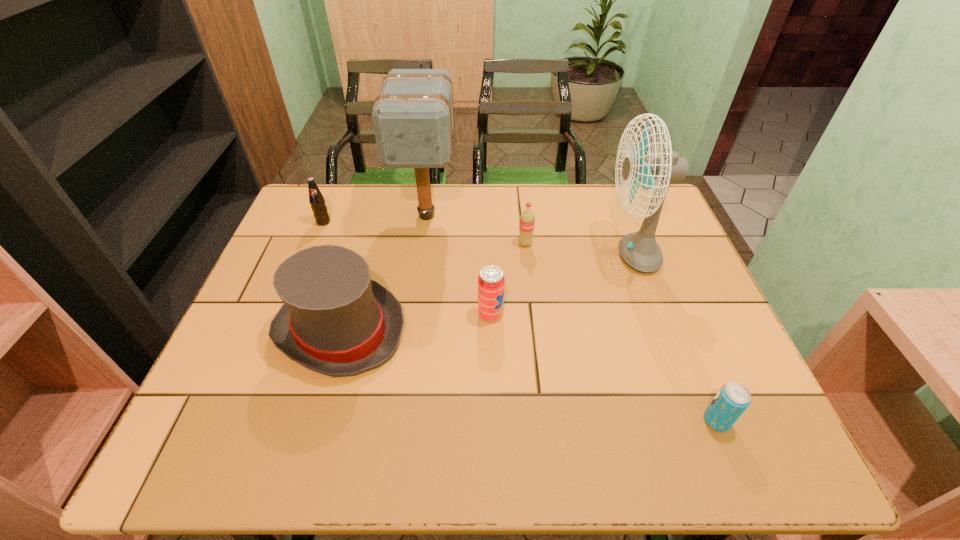
You are a GUI agent. You are given a task and a screenshot of the screen. Output one action in this format:
    pyautogui.click(x=<x>, y=<y>)
    Task: Click on the vacant space located 0.160m on the striking surface of the mallet
    This screenshot has height=540, width=960.
    Given the screenshot: What is the action you would take?
    pyautogui.click(x=417, y=283)

Image resolution: width=960 pixels, height=540 pixels. I want to click on vacant space positioned on the front-facing side of the fan, so click(x=470, y=254).

This screenshot has height=540, width=960. I want to click on free location located on the front-facing side of the fan, so click(x=464, y=254).

At what (x,y) coordinates should I click in order to perform the action: click on vacant region located 0.240m on the front-facing side of the fan. Please return your answer as a coordinate pair (x, y). Looking at the image, I should click on coord(517,254).

At what (x,y) coordinates should I click in order to perform the action: click on vacant region located on the right of the dress hat. Please return your answer as a coordinate pair (x, y). The width and height of the screenshot is (960, 540). Looking at the image, I should click on (537, 330).

Where is `vacant region located on the front label of the leftmost soda can`? vacant region located on the front label of the leftmost soda can is located at coordinates (294, 295).

Locate an element on the screen. Image resolution: width=960 pixels, height=540 pixels. free space located on the front of the third object from right to left is located at coordinates (535, 330).

You are a GUI agent. You are given a task and a screenshot of the screen. Output one action in this format:
    pyautogui.click(x=<x>, y=<y>)
    Task: Click on the free space located on the right of the fourth object from right to left
    The image size is (960, 540).
    Given the screenshot: What is the action you would take?
    pyautogui.click(x=586, y=314)

The width and height of the screenshot is (960, 540). In order to click on free space located on the back of the nearest soda can in this screenshot , I will do `click(668, 300)`.

The width and height of the screenshot is (960, 540). In order to click on mallet present at the far edge in this screenshot , I will do `click(413, 117)`.